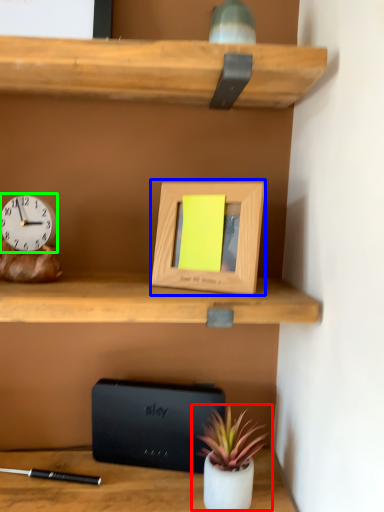
Question: Which object is the closest to the houseplant (highlighted by a red box)? Choose among these: picture frame (highlighted by a blue box) or clock (highlighted by a green box).

Choices:
 (A) picture frame
 (B) clock

Answer: (A)